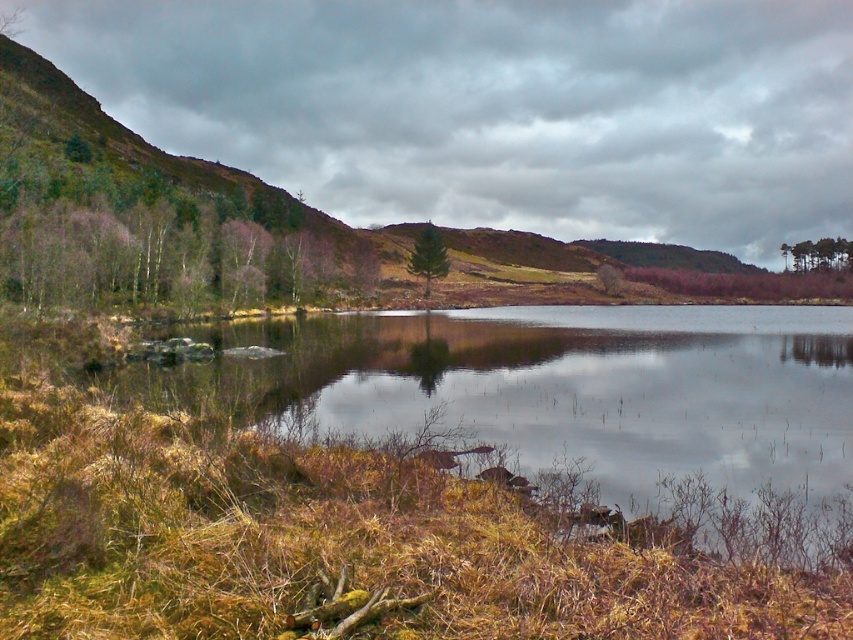
Based on the photo, is green matte tree at upper right wider than green matte tree at center?

Indeed, green matte tree at upper right has a greater width compared to green matte tree at center.

Can you confirm if green matte tree at upper right is smaller than green matte tree at center?

No.

Between point (833, 250) and point (428, 276), which one is positioned behind?

Point (833, 250)

This screenshot has height=640, width=853. I want to click on green matte tree at upper right, so click(x=817, y=253).

Based on the photo, does smooth reflective water at lower center have a larger size compared to green matte tree at upper right?

No, smooth reflective water at lower center is not bigger than green matte tree at upper right.

Who is more distant from viewer, (840, 538) or (795, 264)?

Point (795, 264)

Identify the location of smooth reflective water at lower center. The width and height of the screenshot is (853, 640). (569, 401).

Who is higher up, smooth reflective water at lower center or green matte tree at center?

Positioned higher is green matte tree at center.

Is smooth reflective water at lower center closer to camera compared to green matte tree at center?

Yes, it is in front of green matte tree at center.

At what (x,y) coordinates should I click in order to perform the action: click on smooth reflective water at lower center. Please return your answer as a coordinate pair (x, y). This screenshot has width=853, height=640. Looking at the image, I should click on (569, 401).